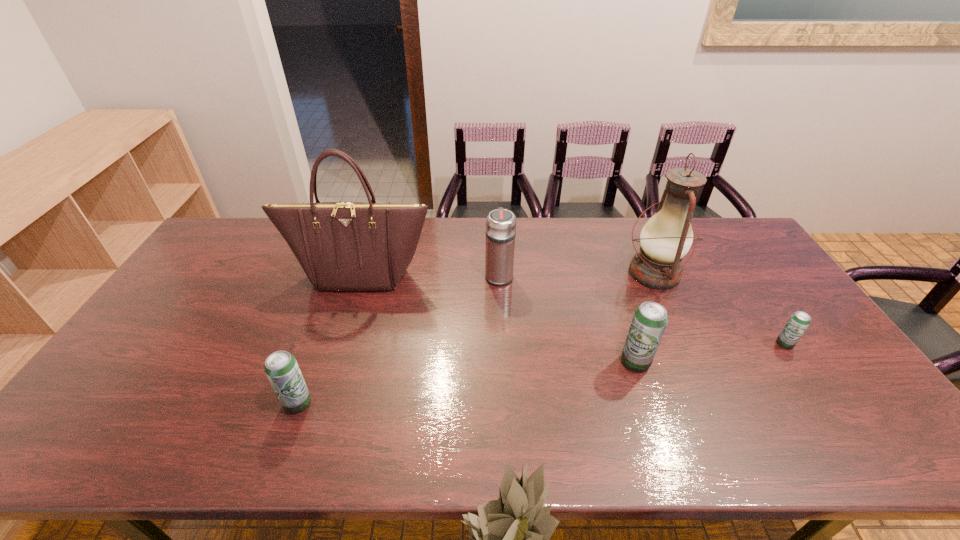
Where is `object located in the right edge section of the desktop`? This screenshot has height=540, width=960. object located in the right edge section of the desktop is located at coordinates (799, 321).

Where is `free space at the far edge of the desktop`? This screenshot has height=540, width=960. free space at the far edge of the desktop is located at coordinates (445, 227).

Find the location of a particular element. This screenshot has height=540, width=960. vacant area at the near edge is located at coordinates (266, 411).

You are a GUI agent. You are given a task and a screenshot of the screen. Output one action in this format:
    pyautogui.click(x=<x>, y=<y>)
    Task: Click on the free space at the left edge of the desktop
    The width and height of the screenshot is (960, 540).
    Given the screenshot: What is the action you would take?
    pyautogui.click(x=139, y=337)

Where is `vacant space at the right edge of the desktop`? The height and width of the screenshot is (540, 960). vacant space at the right edge of the desktop is located at coordinates (732, 267).

Image resolution: width=960 pixels, height=540 pixels. In the image, there is a desktop. Identify the location of blank space at the far left corner. (245, 232).

In the image, there is a desktop. Where is `vacant area at the far right corner`? The image size is (960, 540). vacant area at the far right corner is located at coordinates (720, 243).

The image size is (960, 540). I want to click on blank region between the second beer can from right to left and the farthest beer can, so click(710, 353).

Where is `free spot between the fourth shortest object and the nearest beer can`? Image resolution: width=960 pixels, height=540 pixels. free spot between the fourth shortest object and the nearest beer can is located at coordinates (398, 339).

At what (x,y) coordinates should I click in order to perform the action: click on empty space that is in between the second nearest object and the handbag. Please return your answer as a coordinate pair (x, y). The width and height of the screenshot is (960, 540). Looking at the image, I should click on (498, 319).